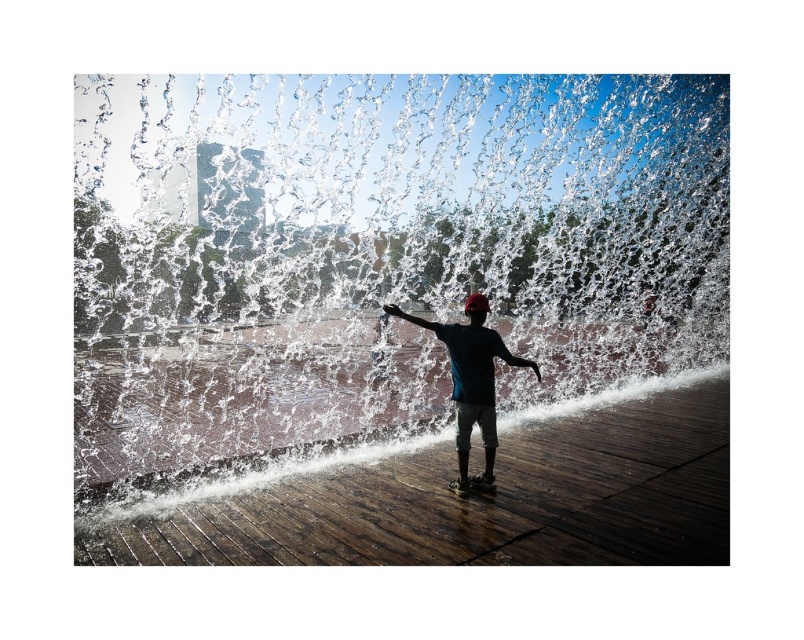
You are a safety inspector evaluating this water feature area. The safety guidelines state that the minimum safe distance between visitors and water jets is 75 feet to prevent injury from high pressure. Based on the scene, is the current distance between the clear water at center and the dark blue fabric shirt at center compliant with the safety guidelines?

The distance between the clear water at center and the dark blue fabric shirt at center is 74.94 feet, which is less than the required 75 feet. Therefore, the current setup does not comply with the safety guidelines.

You are a photographer positioned at the edge of the scene. You need to capture a shot where the clear water at center and the dark blue fabric shirt at center are both in focus. Based on their positions, which object should you focus on first to ensure both are sharp?

Since the clear water at center is to the left of the dark blue fabric shirt at center, you should focus on the clear water at center first as it is closer to the camera. This way, both objects will be in focus due to the overlapping depth of field.